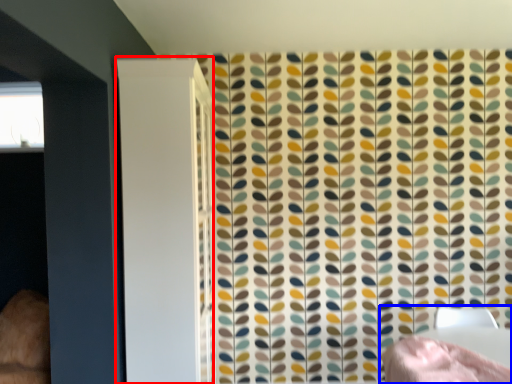
Question: Which of the following is the farthest to the observer, screen door (highlighted by a red box) or bed (highlighted by a blue box)?

Choices:
 (A) screen door
 (B) bed

Answer: (A)